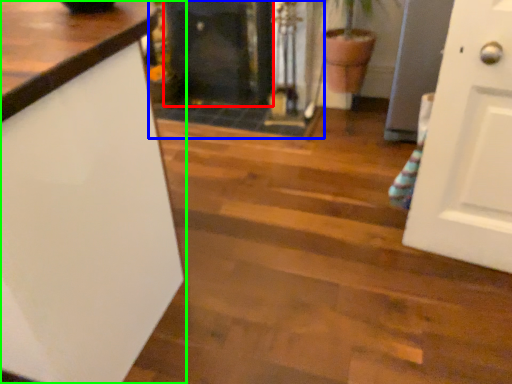
Question: Estimate the real-world distances between objects in this image. Which object is closer to fireplace (highlighted by a red box), fireplace (highlighted by a blue box) or countertop (highlighted by a green box)?

Choices:
 (A) fireplace
 (B) countertop

Answer: (A)